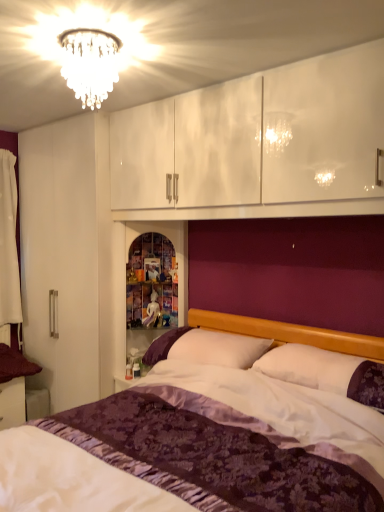
Question: From the image's perspective, is white soft pillow at center above or below white fabric curtain at left?

Choices:
 (A) above
 (B) below

Answer: (B)

Question: In the image, is white soft pillow at center on the left side or the right side of white fabric curtain at left?

Choices:
 (A) left
 (B) right

Answer: (B)

Question: Considering the real-world distances, which object is farthest from the white fabric curtain at left?

Choices:
 (A) crystal chandelier at upper center
 (B) white soft pillow at center
 (C) purple satin bed at center

Answer: (B)

Question: Which of these objects is positioned closest to the purple satin bed at center?

Choices:
 (A) white soft pillow at center
 (B) crystal chandelier at upper center
 (C) white fabric curtain at left

Answer: (A)